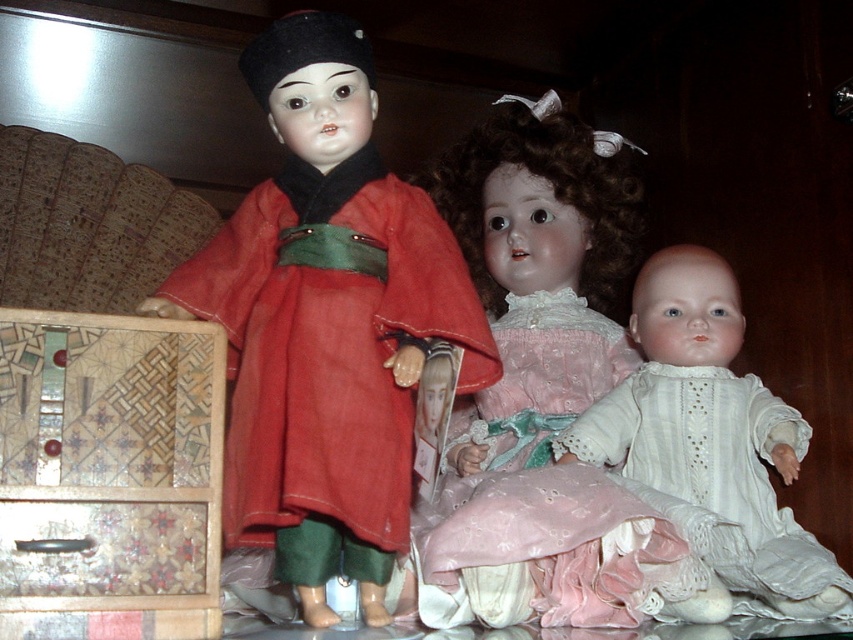
You are organizing a doll collection and need to place the matte red kimono at center and the wooden drawer at lower left in a display case. According to their positions in the image, which object should be placed to the right of the other?

The matte red kimono at center is positioned on the right side of the wooden drawer at lower left, so the matte red kimono at center should be placed to the right of the wooden drawer at lower left.

You are a collector examining the dolls and want to determine which one is nearer to you. You see the matte red kimono at center and the pink lace dress at center. Which doll is closer to you?

The matte red kimono at center is closer to the viewer than the pink lace dress at center.